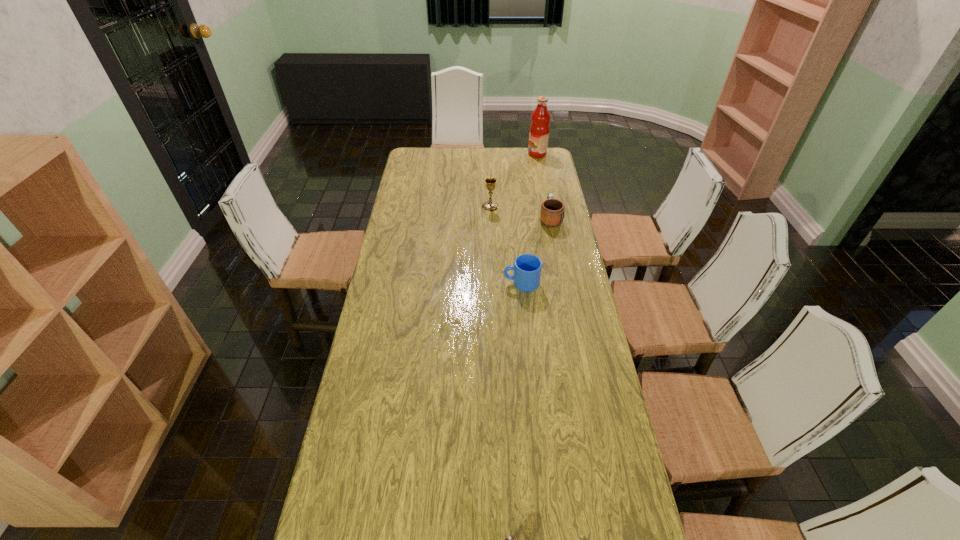
Identify the location of free space at the right edge of the desktop. This screenshot has height=540, width=960. (616, 418).

In the image, there is a desktop. What are the coordinates of `free space at the far left corner` in the screenshot? It's located at (432, 167).

This screenshot has width=960, height=540. I want to click on free space between the farther mug and the fourth farthest object, so click(x=536, y=251).

This screenshot has width=960, height=540. What are the coordinates of `vacant space in between the nearer mug and the fourth shortest object` in the screenshot? It's located at (506, 245).

Locate an element on the screen. The image size is (960, 540). vacant area that lies between the chalice and the fruit juice is located at coordinates (514, 180).

Image resolution: width=960 pixels, height=540 pixels. Find the location of `free space between the farther mug and the second tallest object`. free space between the farther mug and the second tallest object is located at coordinates (520, 213).

I want to click on free space between the fruit juice and the fourth shortest object, so click(514, 180).

Image resolution: width=960 pixels, height=540 pixels. Find the location of `unoccupied area between the right mug and the farthest object`. unoccupied area between the right mug and the farthest object is located at coordinates (543, 186).

Find the location of a particular element. The image size is (960, 540). free space between the left mug and the farthest object is located at coordinates (529, 218).

Where is `free space between the right mug and the tallest object`? The width and height of the screenshot is (960, 540). free space between the right mug and the tallest object is located at coordinates (543, 186).